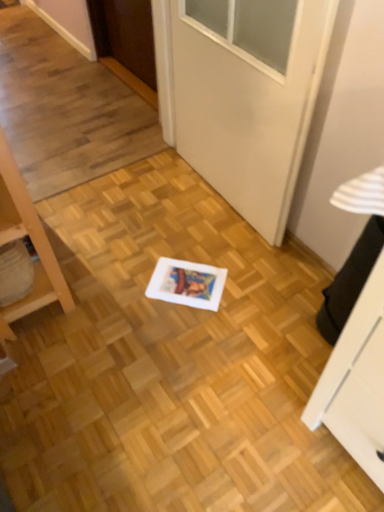
Where is `vacant space situated on the left part of white glossy door at center`? vacant space situated on the left part of white glossy door at center is located at coordinates (145, 207).